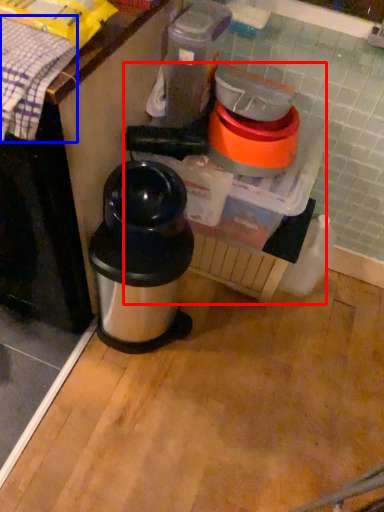
Question: Which of the following is the farthest to the observer, blender (highlighted by a red box) or blanket (highlighted by a blue box)?

Choices:
 (A) blender
 (B) blanket

Answer: (A)